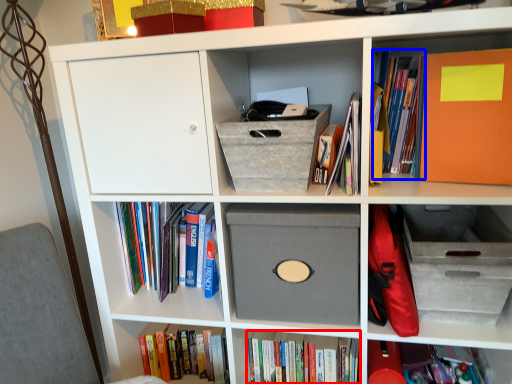
Question: Which object is closer to the camera taking this photo, book (highlighted by a red box) or book (highlighted by a blue box)?

Choices:
 (A) book
 (B) book

Answer: (B)